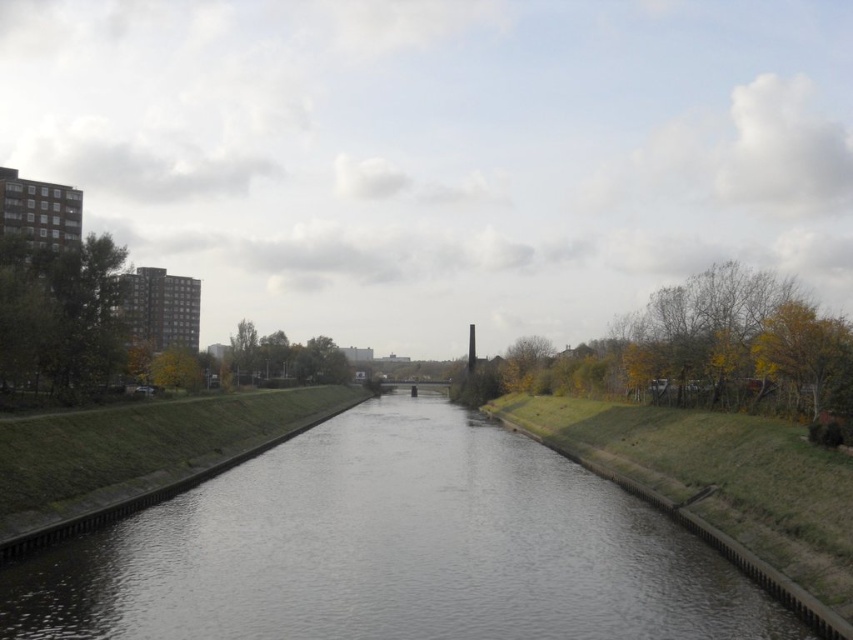
You are standing on the bank of the gray concrete river at center and want to see the top of the green leafy tree at left. Can you see the top of the tree without moving your position?

The gray concrete river at center is not as tall as green leafy tree at left, so yes, you can see the top of the green leafy tree at left from your current position on the bank of the gray concrete river at center since the tree is taller than the river.

You are planning to build a small garden shed on the left bank of the canal. The shed requires a space of 10 square meters. Considering the gray concrete river at center and the green leafy tree at left, which object might pose a spatial constraint for your project?

The gray concrete river at center is larger in size than the green leafy tree at left, so it might occupy more space and could pose a spatial constraint for building the garden shed.